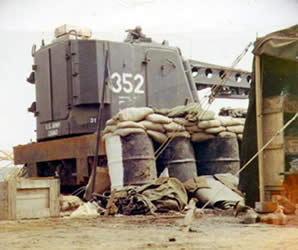
Locate an element on the screen. The image size is (298, 250). wooden crate is located at coordinates (16, 196).